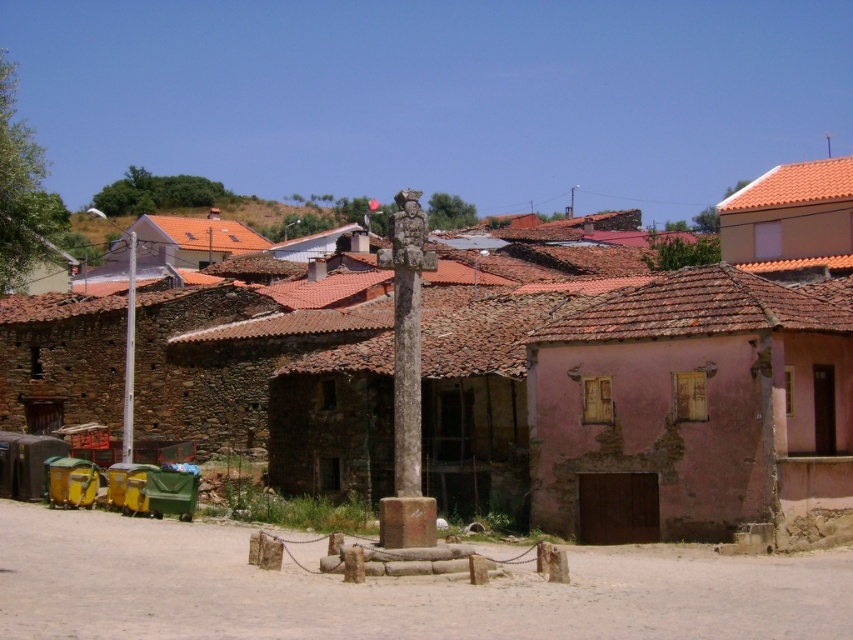
Question: Which object appears farthest from the camera in this image?

Choices:
 (A) white stone pillar at center
 (B) stone cross at center

Answer: (A)

Question: Which of the following is the closest to the observer?

Choices:
 (A) (341, 371)
 (B) (134, 278)

Answer: (A)

Question: Which of the following is the closest to the observer?

Choices:
 (A) stone cross at center
 (B) white stone pillar at center

Answer: (A)

Question: Where is stone cross at center located in relation to white stone pillar at center in the image?

Choices:
 (A) below
 (B) above

Answer: (B)

Question: Is stone cross at center thinner than white stone pillar at center?

Choices:
 (A) no
 (B) yes

Answer: (A)

Question: Does stone cross at center have a smaller size compared to white stone pillar at center?

Choices:
 (A) yes
 (B) no

Answer: (B)